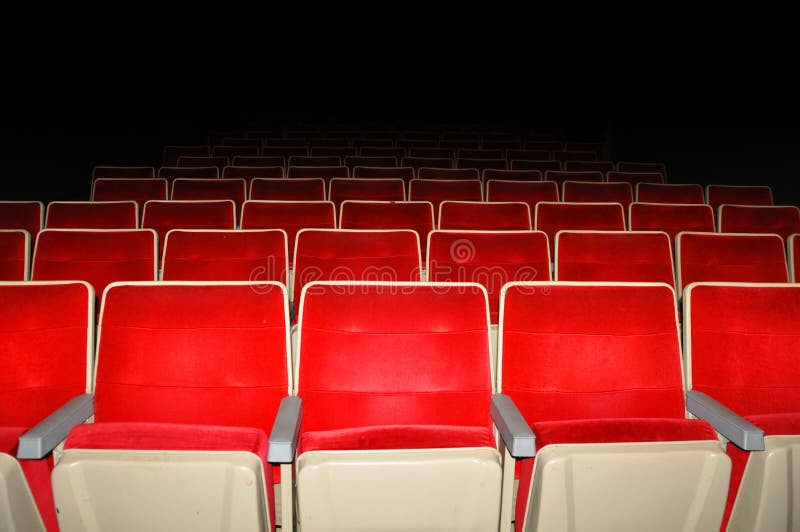
The height and width of the screenshot is (532, 800). In order to click on seats in first row in this screenshot , I will do `click(69, 356)`, `click(216, 353)`, `click(737, 347)`, `click(624, 351)`, `click(410, 363)`.